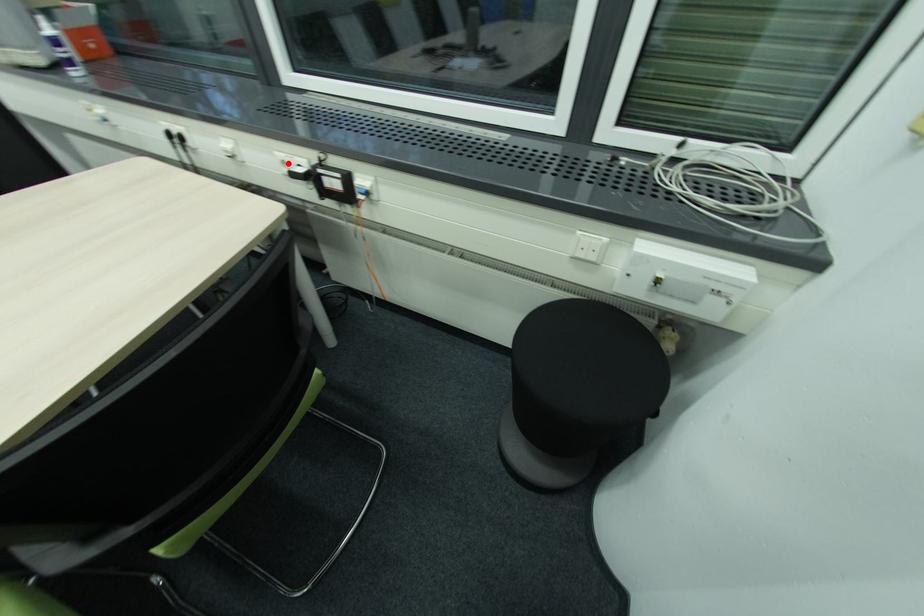
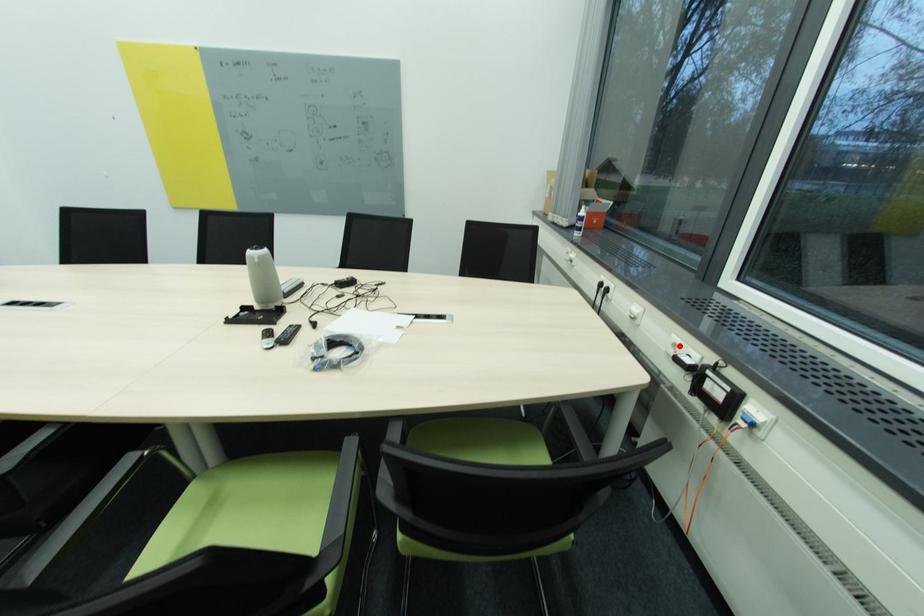
I am providing you with two images of the same scene from different viewpoints. A red point is marked on the first image and another point is marked on the second image. Are the points marked in image1 and image2 representing the same 3D position?

Yes